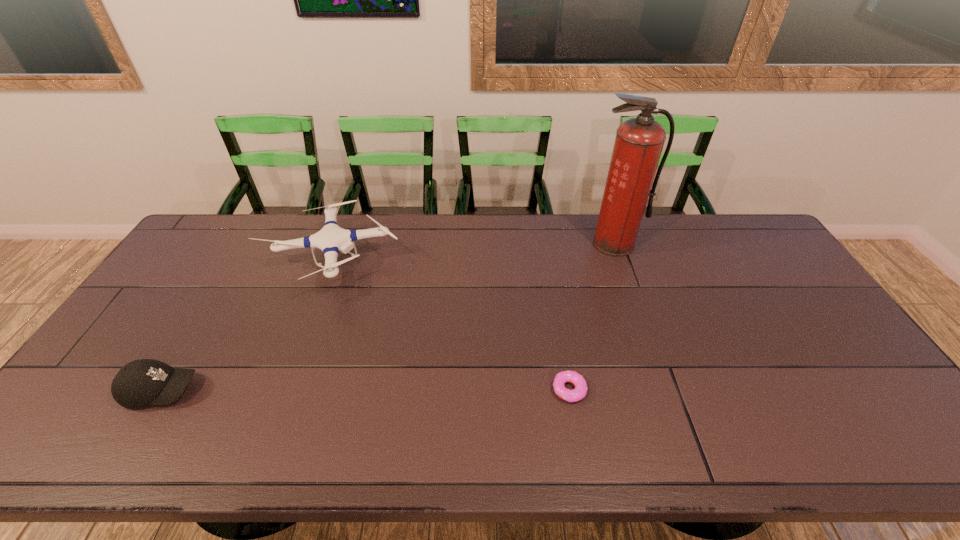
Locate an element on the screen. the rightmost object is located at coordinates (639, 141).

This screenshot has height=540, width=960. What are the coordinates of `the tallest object` in the screenshot? It's located at (639, 141).

Locate an element on the screen. drone is located at coordinates (331, 239).

Where is `the third tallest object`? The image size is (960, 540). the third tallest object is located at coordinates (141, 382).

The height and width of the screenshot is (540, 960). I want to click on doughnut, so tap(577, 394).

Image resolution: width=960 pixels, height=540 pixels. In order to click on the third object from left to right in this screenshot , I will do `click(577, 394)`.

Find the location of a particular element. The height and width of the screenshot is (540, 960). free space located 0.110m at the nozzle of the fire extinguisher is located at coordinates (627, 279).

Identify the location of free region located 0.130m on the front of the second tallest object. This screenshot has height=540, width=960. (303, 342).

In order to click on free space located on the front-facing side of the baseball cap in this screenshot , I will do `click(271, 390)`.

Where is `vacant space located on the left of the doughnut`? The height and width of the screenshot is (540, 960). vacant space located on the left of the doughnut is located at coordinates (396, 390).